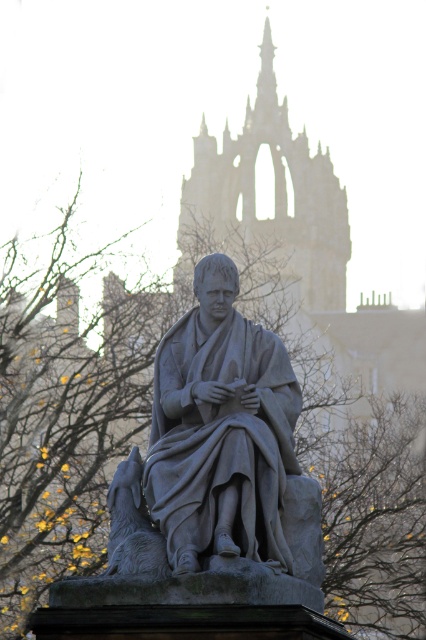
You are standing in front of the statue and want to take a photo that includes both the gray stone statue at center and the stone spire at center. Based on their positions, where should you position the statue relative to the spire in your camera frame?

The gray stone statue at center is below the stone spire at center, so to include both in your photo, position the statue lower in the frame so the spire appears above it.

You are standing in front of a statue in a Gothic setting. The statue is located at coordinates 0.673, 0.519. If you want to take a photo of the gray stone statue at center from directly in front, where should you position yourself relative to the statue?

To take a photo of the gray stone statue at center from directly in front, you should position yourself facing the statue at coordinates (221, 429), ensuring you are aligned with its central axis.